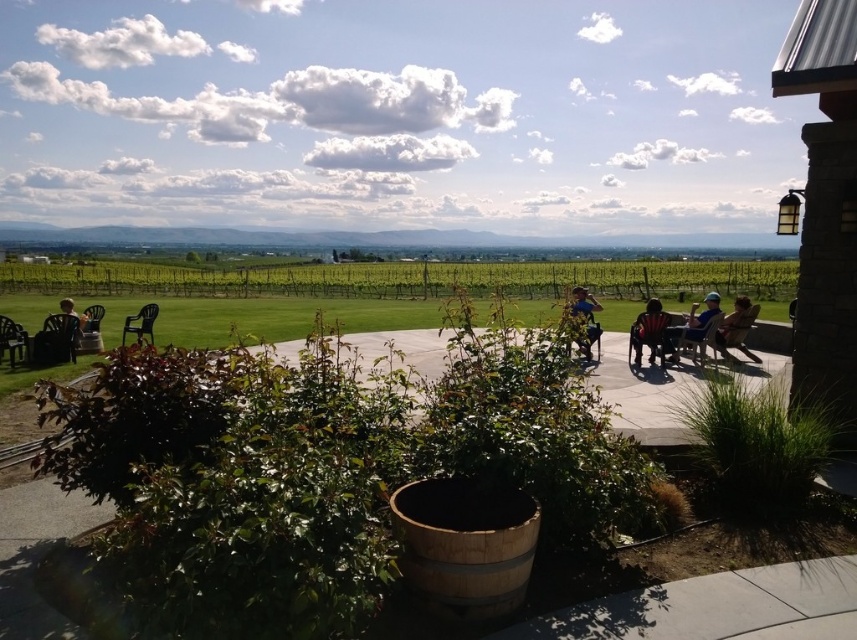
Can you confirm if green grass at center is bigger than matte black chair at left?

Yes, green grass at center is bigger than matte black chair at left.

Is green grass at center above matte black chair at left?

Correct, green grass at center is located above matte black chair at left.

Between point (723, 266) and point (79, 326), which one is positioned behind?

Point (723, 266)

Image resolution: width=857 pixels, height=640 pixels. In order to click on green grass at center in this screenshot , I will do `click(411, 278)`.

Is blue denim jeans at center shorter than matte black chair at left?

No.

Between point (588, 296) and point (70, 301), which one is positioned behind?

The point (588, 296) is behind.

Identify the location of blue denim jeans at center. (586, 317).

In the scene shown: Can you confirm if matte black chair at center is thinner than matte black chair at left?

Correct, matte black chair at center's width is less than matte black chair at left's.

Who is shorter, matte black chair at center or matte black chair at left?

With less height is matte black chair at left.

Is point (646, 328) behind point (66, 307)?

That is False.

At what (x,y) coordinates should I click in order to perform the action: click on matte black chair at center. Please return your answer as a coordinate pair (x, y). Looking at the image, I should click on (650, 332).